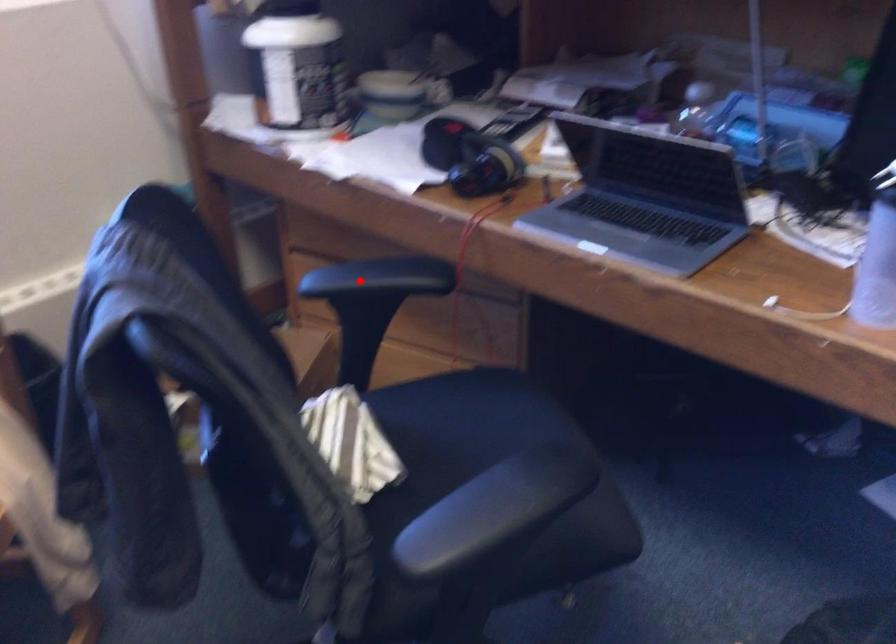
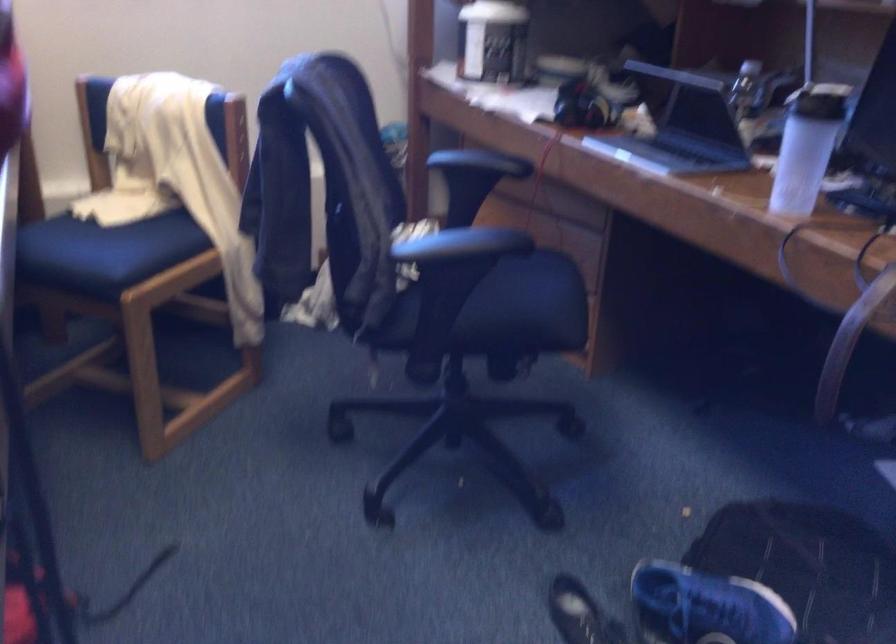
Question: I am providing you with two images of the same scene from different viewpoints. Given a red point in image1, look at the same physical point in image2. Is it:

Choices:
 (A) Closer to the viewpoint
 (B) Farther from the viewpoint

Answer: (B)